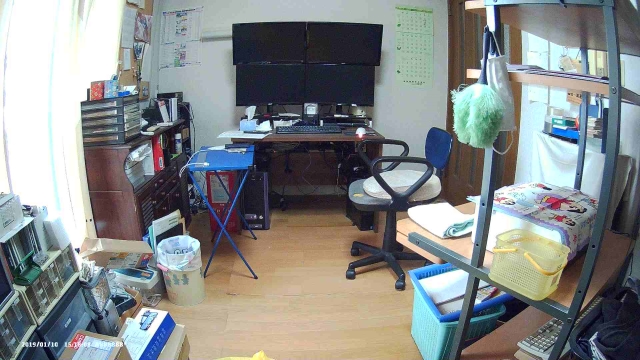
Image resolution: width=640 pixels, height=360 pixels. Find the location of `drawer`. drawer is located at coordinates (157, 186), (182, 194), (160, 195), (180, 165).